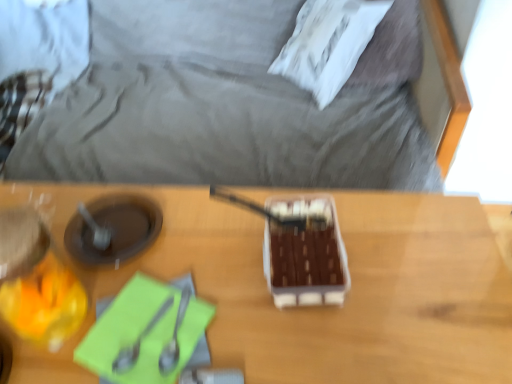
Where is `free space underneath green matte notepad at lower left (from a real-world perspective)`? Image resolution: width=512 pixels, height=384 pixels. free space underneath green matte notepad at lower left (from a real-world perspective) is located at coordinates (152, 325).